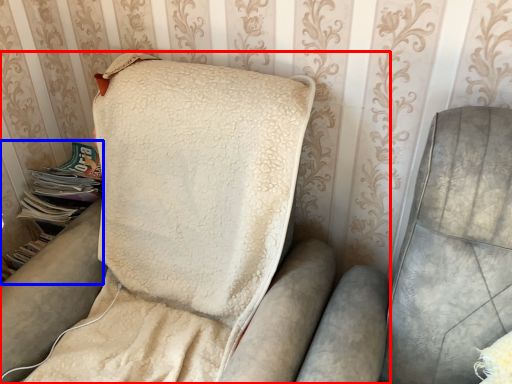
Question: Which of the following is the closest to the observer, furniture (highlighted by a red box) or magazine (highlighted by a blue box)?

Choices:
 (A) furniture
 (B) magazine

Answer: (A)